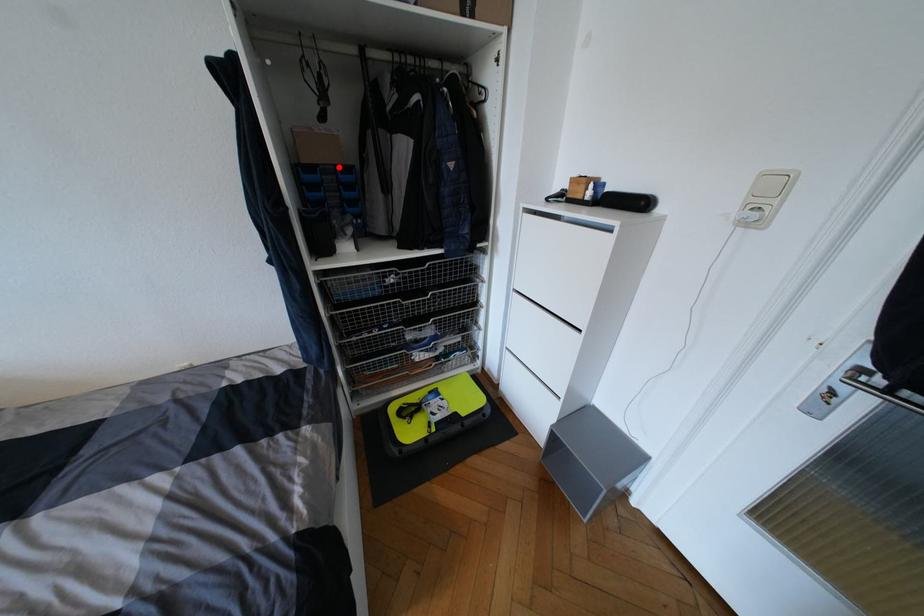
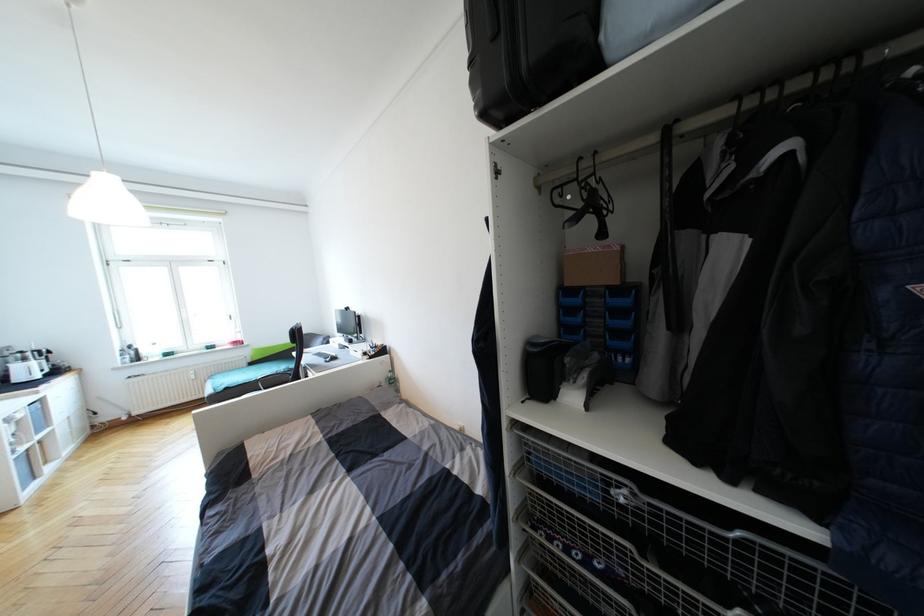
Where in the second image is the point corresponding to the highlighted location from the first image?

(611, 288)